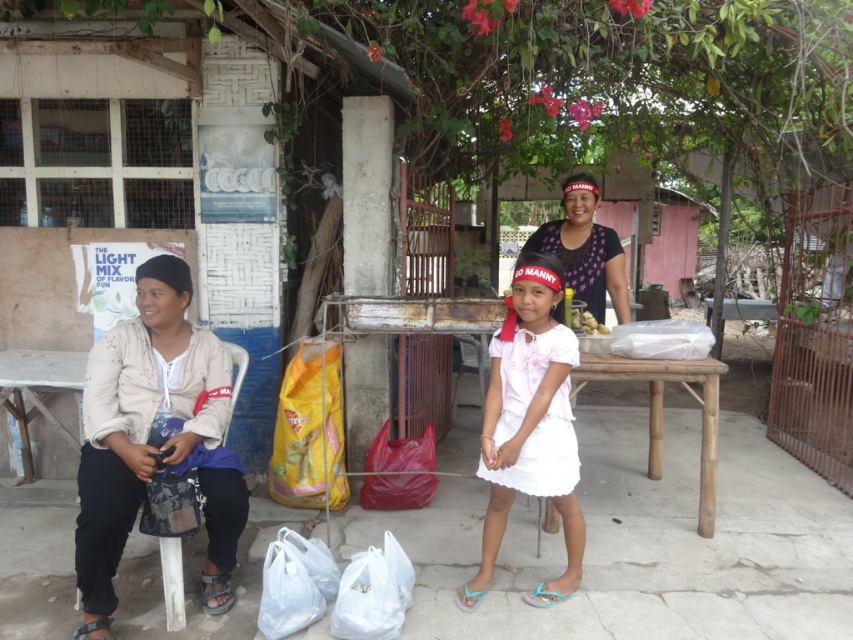
Question: Among these objects, which one is farthest from the camera?

Choices:
 (A) matte pink fabric at center
 (B) white cotton dress at center
 (C) white painted wood hut at left

Answer: (A)

Question: Does white cotton dress at center appear over matte pink fabric at center?

Choices:
 (A) no
 (B) yes

Answer: (A)

Question: Which object is positioned closest to the smooth brown nuts at center?

Choices:
 (A) white painted wood hut at left
 (B) matte white shirt at left
 (C) matte pink fabric at center

Answer: (C)

Question: Which point is farther to the camera?

Choices:
 (A) white cotton dress at center
 (B) white painted wood hut at left

Answer: (B)

Question: Is white cotton dress at center below matte pink fabric at center?

Choices:
 (A) no
 (B) yes

Answer: (B)

Question: Is white cotton dress at center smaller than smooth brown nuts at center?

Choices:
 (A) no
 (B) yes

Answer: (A)